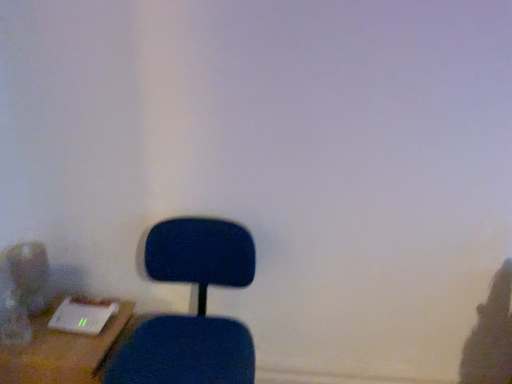
Question: Is blue fabric chair at lower left wider or thinner than wooden desk at lower left?

Choices:
 (A) thin
 (B) wide

Answer: (B)

Question: In terms of height, does blue fabric chair at lower left look taller or shorter compared to wooden desk at lower left?

Choices:
 (A) tall
 (B) short

Answer: (A)

Question: From a real-world perspective, is blue fabric chair at lower left physically located above or below wooden desk at lower left?

Choices:
 (A) above
 (B) below

Answer: (A)

Question: Looking at their shapes, would you say wooden desk at lower left is wider or thinner than blue fabric chair at lower left?

Choices:
 (A) thin
 (B) wide

Answer: (A)

Question: In terms of height, does wooden desk at lower left look taller or shorter compared to blue fabric chair at lower left?

Choices:
 (A) short
 (B) tall

Answer: (A)

Question: Is point (65, 332) positioned closer to the camera than point (198, 365)?

Choices:
 (A) closer
 (B) farther

Answer: (B)

Question: Considering their positions, is wooden desk at lower left located in front of or behind blue fabric chair at lower left?

Choices:
 (A) behind
 (B) front

Answer: (A)